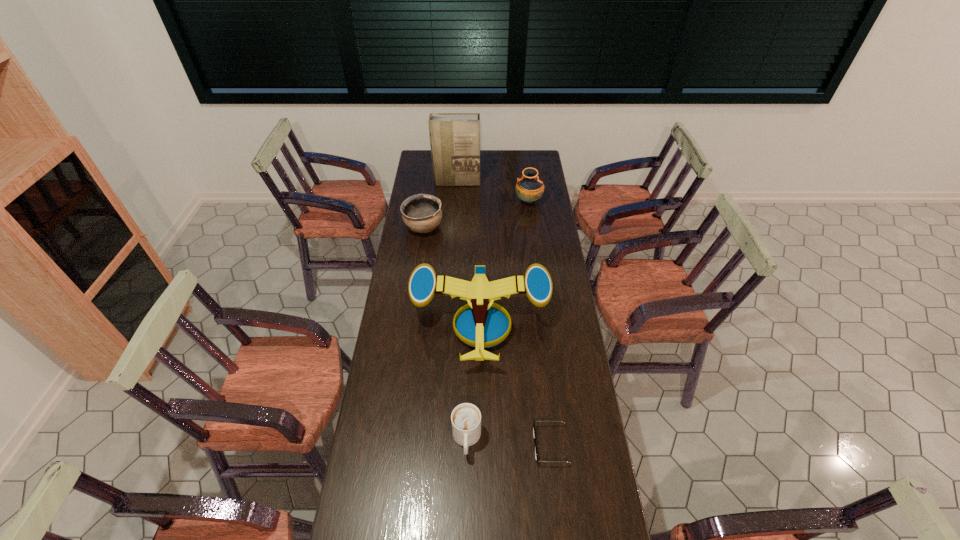
At what (x,y) coordinates should I click in order to perform the action: click on pottery located in the right edge section of the desktop. Please return your answer as a coordinate pair (x, y). Image resolution: width=960 pixels, height=540 pixels. Looking at the image, I should click on (529, 188).

Image resolution: width=960 pixels, height=540 pixels. I want to click on drone situated at the right edge, so click(481, 326).

Locate an element on the screen. The width and height of the screenshot is (960, 540). spectacles that is positioned at the right edge is located at coordinates (534, 434).

Locate an element on the screen. Image resolution: width=960 pixels, height=540 pixels. vacant area at the left edge is located at coordinates (407, 405).

In the image, there is a desktop. Where is `vacant region at the right edge`? The image size is (960, 540). vacant region at the right edge is located at coordinates (527, 211).

Find the location of a particular element. The image size is (960, 540). free space between the spectacles and the fourth farthest object is located at coordinates (516, 383).

The width and height of the screenshot is (960, 540). I want to click on vacant point located between the drone and the fifth nearest object, so click(504, 261).

Identify the location of unoccupied position between the cappuccino and the nearer pottery. The image size is (960, 540). (445, 333).

Image resolution: width=960 pixels, height=540 pixels. I want to click on free space between the drone and the farther pottery, so click(504, 261).

Where is `free space that is in between the left pottery and the fourth farthest object`? free space that is in between the left pottery and the fourth farthest object is located at coordinates (452, 274).